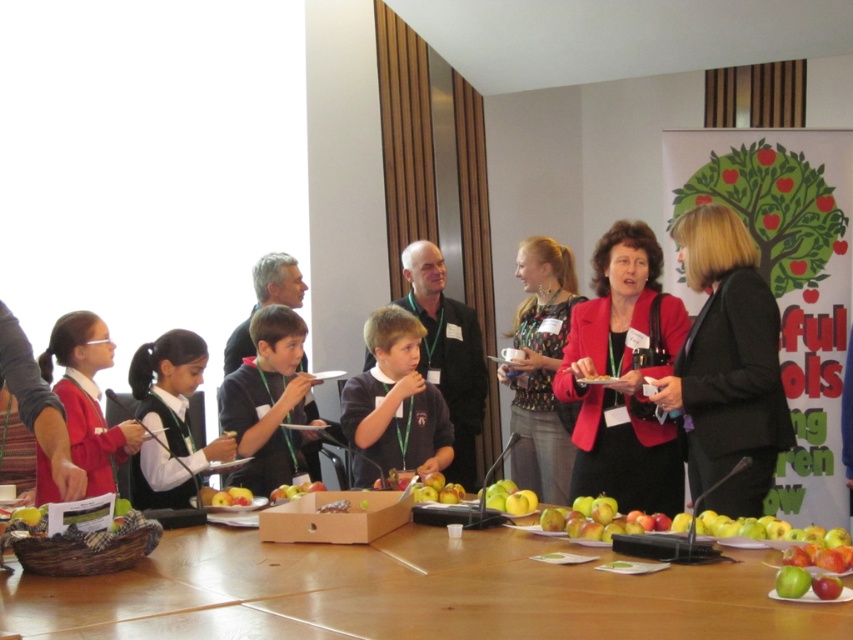
You are standing at the back of the conference room and want to walk to the table. There are two points marked on the floor near the table. One is at point (770, 364) and the other is at point (267, 486). Which point is closer to you as you approach the table from the back?

Point (770, 364) is in front of point (267, 486), so the point closer to you as you approach the table from the back would be point (267, 486) since it is behind point (770, 364).

You are standing in the conference room and want to place a small object on the wooden table at center. However, there is a matte red blazer at center in your way. Can you reach the table without moving the blazer?

The wooden table at center is closer to the viewer than the matte red blazer at center, so you can reach the table without moving the blazer.

You are organizing a small event in the conference room and need to place a large decorative centerpiece on the wooden table at center. Considering the space occupied by the matte red blazer at center, will the table have enough room for the centerpiece?

The wooden table at center occupies less space than the matte red blazer at center, meaning the table itself is smaller. Therefore, placing a large decorative centerpiece might not leave enough space, as the table is already smaller in size compared to the blazer.